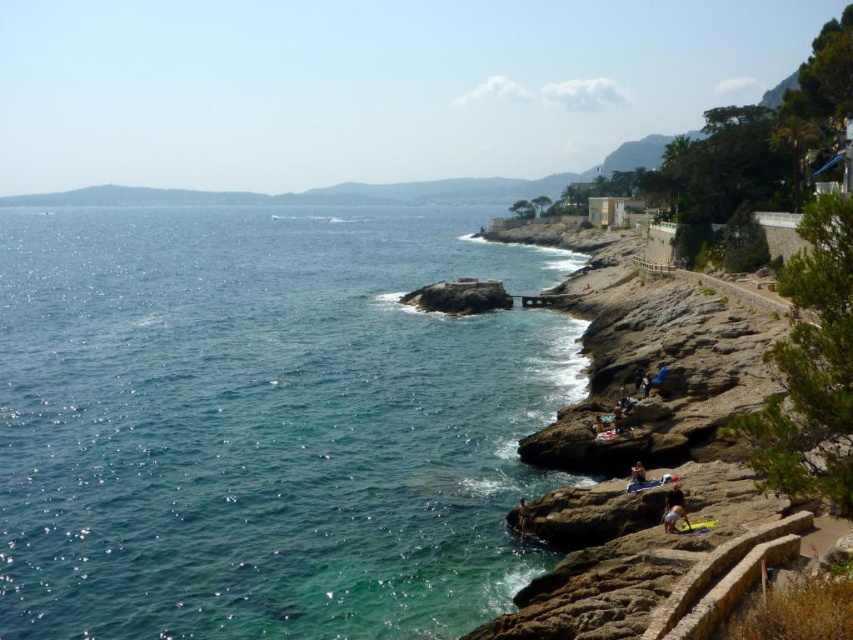
How distant is clear blue water at left from light blue denim shorts at lower center?

clear blue water at left is 233.02 feet away from light blue denim shorts at lower center.

Can you confirm if clear blue water at left is positioned to the left of light blue denim shorts at lower center?

Correct, you'll find clear blue water at left to the left of light blue denim shorts at lower center.

Describe the element at coordinates (265, 422) in the screenshot. The height and width of the screenshot is (640, 853). I see `clear blue water at left` at that location.

Locate an element on the screen. This screenshot has height=640, width=853. clear blue water at left is located at coordinates (265, 422).

Is rusty stone at center further to the viewer compared to light blue denim shorts at lower center?

Yes, rusty stone at center is behind light blue denim shorts at lower center.

Can you confirm if rusty stone at center is wider than light blue denim shorts at lower center?

Indeed, rusty stone at center has a greater width compared to light blue denim shorts at lower center.

Locate an element on the screen. This screenshot has height=640, width=853. rusty stone at center is located at coordinates (459, 296).

Can you confirm if brown rock at lower right is thinner than light blue denim shorts at lower center?

In fact, brown rock at lower right might be wider than light blue denim shorts at lower center.

Between brown rock at lower right and light blue denim shorts at lower center, which one appears on the left side from the viewer's perspective?

From the viewer's perspective, light blue denim shorts at lower center appears more on the left side.

Identify the location of brown rock at lower right. (636, 444).